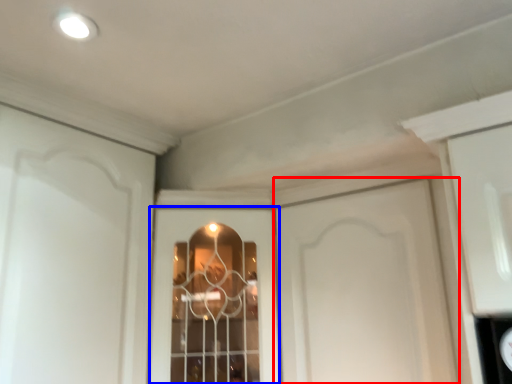
Question: Among these objects, which one is farthest to the camera, door (highlighted by a red box) or window (highlighted by a blue box)?

Choices:
 (A) door
 (B) window

Answer: (B)